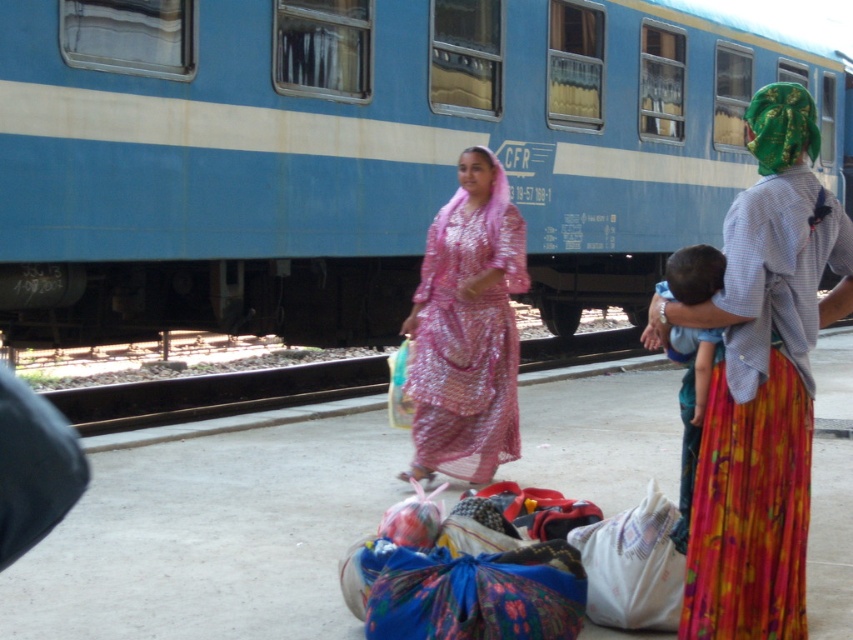
You are a photographer standing at the railway station. You want to take a photo that includes both the blue painted train at center and the pink sequined dress at center. The minimum distance required for your camera to focus on both subjects clearly is 4 meters. Can you capture both subjects in focus without moving either the train or the dress?

The blue painted train at center and the pink sequined dress at center are 4.19 meters apart. Since the minimum focus distance required is 4 meters, the camera can capture both subjects in focus as the distance between them exceeds the required 4 meters.

You are a photographer standing at the railway station. You want to take a photo of the blue painted train at center and the pink sequined dress at center. Which object will appear larger in the photo?

The blue painted train at center will appear larger in the photo because it is positioned over the pink sequined dress at center, indicating it is closer to the camera.

You are a photographer trying to capture both the blue painted train at center and the pink sequined dress at center in a single frame. Which object should you focus on first to ensure both are in the shot?

You should focus on the blue painted train at center first because it is wider than the pink sequined dress at center, allowing you to frame the wider object first to include both in the shot.